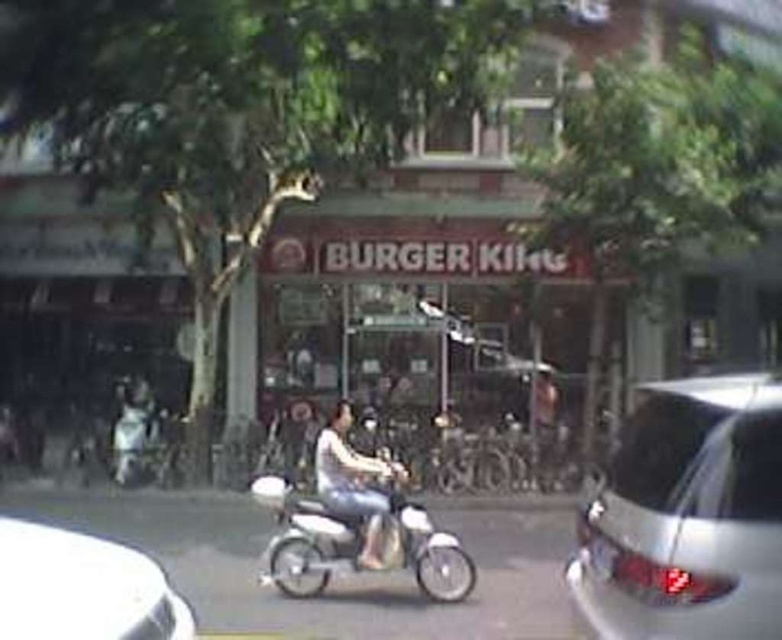
Who is higher up, shiny silver car at right or white glossy car at lower left?

Positioned higher is white glossy car at lower left.

Consider the image. Is shiny silver car at right smaller than white glossy car at lower left?

Yes.

Who is more distant from viewer, (622, 534) or (13, 548)?

The point (622, 534) is behind.

Locate an element on the screen. This screenshot has width=782, height=640. shiny silver car at right is located at coordinates (687, 516).

Between metallic silver motorcycle at center and light brown leather jacket at center, which one is positioned lower?

light brown leather jacket at center is below.

Is point (395, 545) positioned before point (381, 467)?

Yes, point (395, 545) is closer to viewer.

At what (x,y) coordinates should I click in order to perform the action: click on metallic silver motorcycle at center. Please return your answer as a coordinate pair (x, y). This screenshot has height=640, width=782. Looking at the image, I should click on (305, 538).

Locate an element on the screen. The image size is (782, 640). metallic silver motorcycle at center is located at coordinates (305, 538).

Is point (689, 492) closer to viewer compared to point (317, 483)?

Yes.

Does shiny silver car at right have a greater height compared to light brown leather jacket at center?

No, shiny silver car at right is not taller than light brown leather jacket at center.

This screenshot has width=782, height=640. Describe the element at coordinates (687, 516) in the screenshot. I see `shiny silver car at right` at that location.

This screenshot has width=782, height=640. In order to click on shiny silver car at right in this screenshot , I will do `click(687, 516)`.